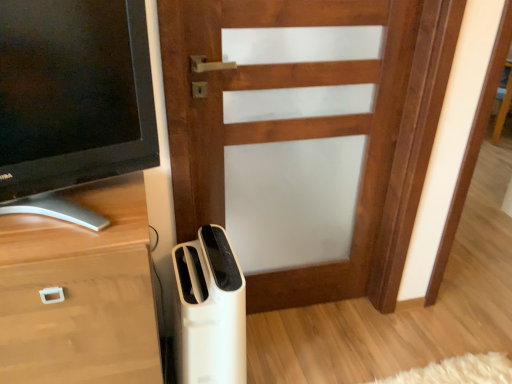
Locate an element on the screen. vacant space underneath matte black tv at left (from a real-world perspective) is located at coordinates (99, 214).